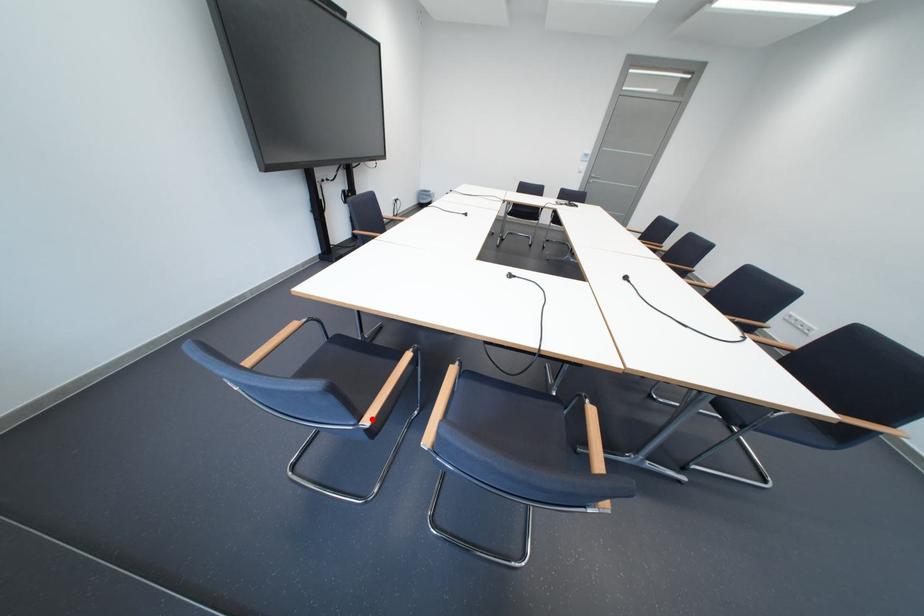
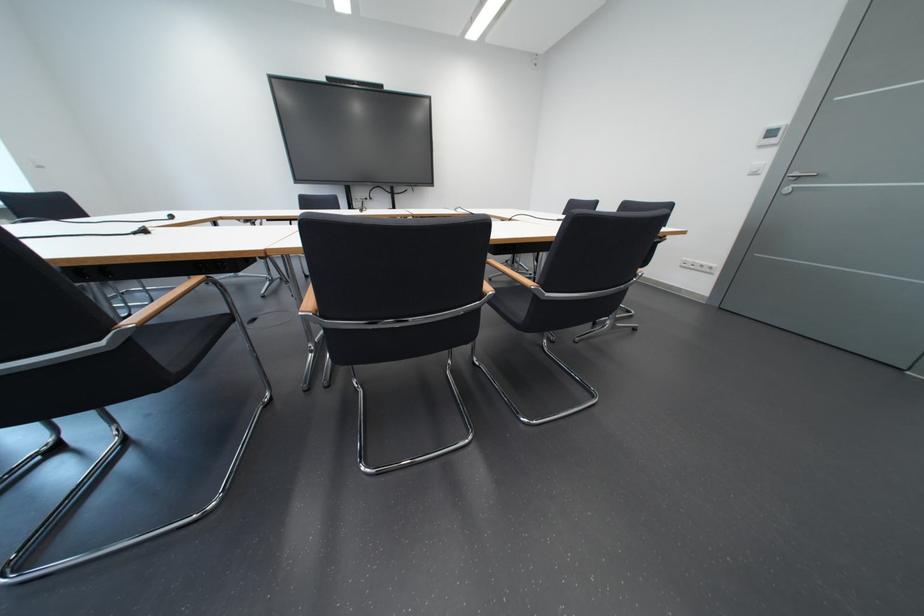
Question: I am providing you with two images of the same scene from different viewpoints. A red point is marked on the first image. Can you still see the location of the red point in image 2?

Choices:
 (A) Yes
 (B) No

Answer: (B)